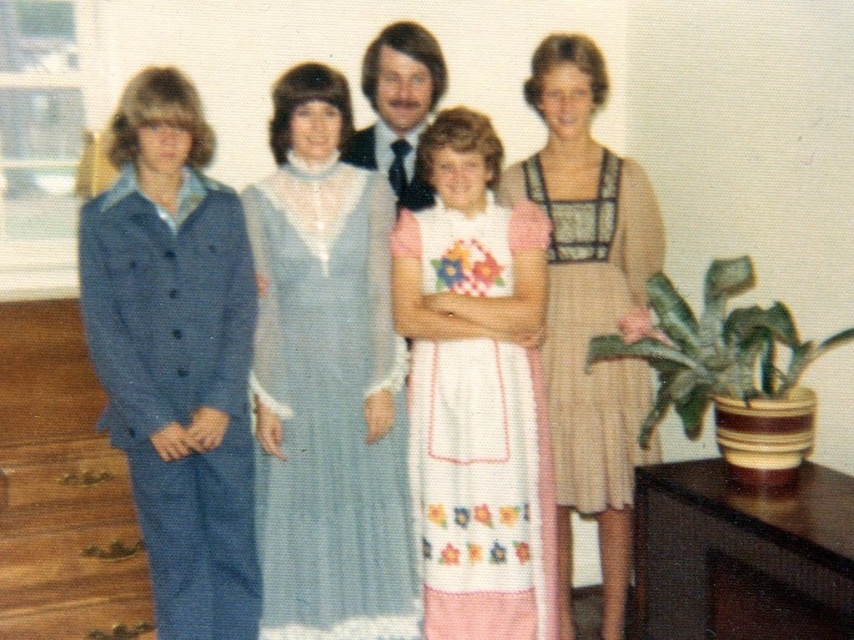
Question: Which of the following is the closest to the observer?

Choices:
 (A) beige textured dress at center
 (B) white embroidered dress at center

Answer: (B)

Question: Can you confirm if white embroidered dress at center is wider than smooth brown hair at center?

Choices:
 (A) no
 (B) yes

Answer: (B)

Question: Is light blue sheer fabric dress at center below light brown textured dress at center?

Choices:
 (A) yes
 (B) no

Answer: (A)

Question: Which point is farther to the camera?

Choices:
 (A) (382, 65)
 (B) (328, 497)
 (C) (645, 212)

Answer: (C)

Question: Which point is closer to the camera?

Choices:
 (A) (595, 381)
 (B) (436, 564)

Answer: (B)

Question: Is beige textured dress at center wider than smooth brown hair at center?

Choices:
 (A) yes
 (B) no

Answer: (A)